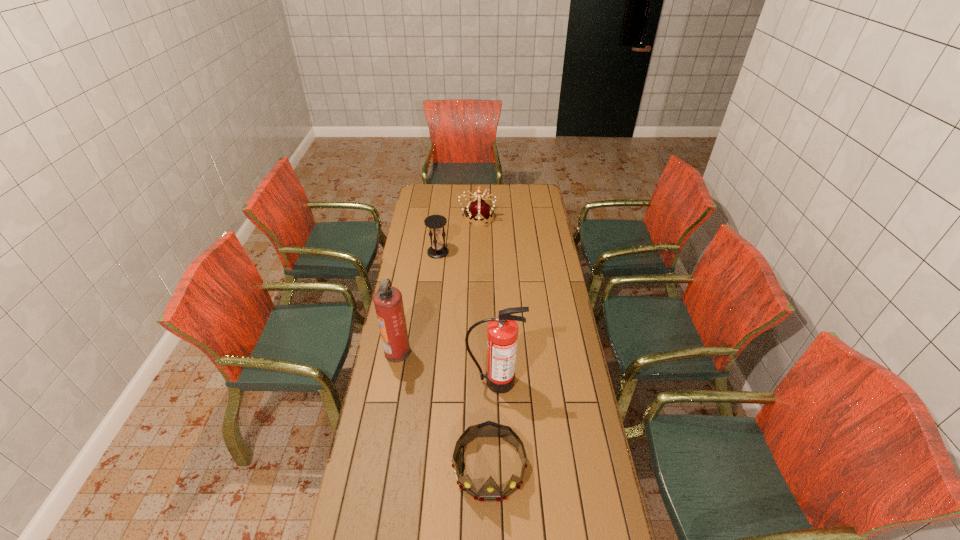
In order to click on vacant area at the far right corner of the desktop in this screenshot , I will do `click(539, 195)`.

This screenshot has width=960, height=540. In order to click on vacant area that lies between the farther tiara and the second farthest object in this screenshot , I will do point(458,235).

I want to click on vacant space in between the hourglass and the nearer fire extinguisher, so click(x=466, y=317).

The width and height of the screenshot is (960, 540). In order to click on vacant point located between the shorter tiara and the farthest object in this screenshot , I will do `click(483, 342)`.

Where is `blank region between the second farthest object and the farther tiara`? blank region between the second farthest object and the farther tiara is located at coordinates (458, 235).

Locate an element on the screen. This screenshot has height=540, width=960. blank region between the farther fire extinguisher and the fourth farthest object is located at coordinates (445, 367).

Where is `free space between the fourth nearest object and the farthest object`? Image resolution: width=960 pixels, height=540 pixels. free space between the fourth nearest object and the farthest object is located at coordinates coord(458,235).

The width and height of the screenshot is (960, 540). I want to click on free space between the hourglass and the right fire extinguisher, so click(466, 317).

I want to click on the third closest object to the left fire extinguisher, so click(x=437, y=250).

Locate an element on the screen. This screenshot has height=540, width=960. object that is the fourth closest to the farther tiara is located at coordinates (490, 491).